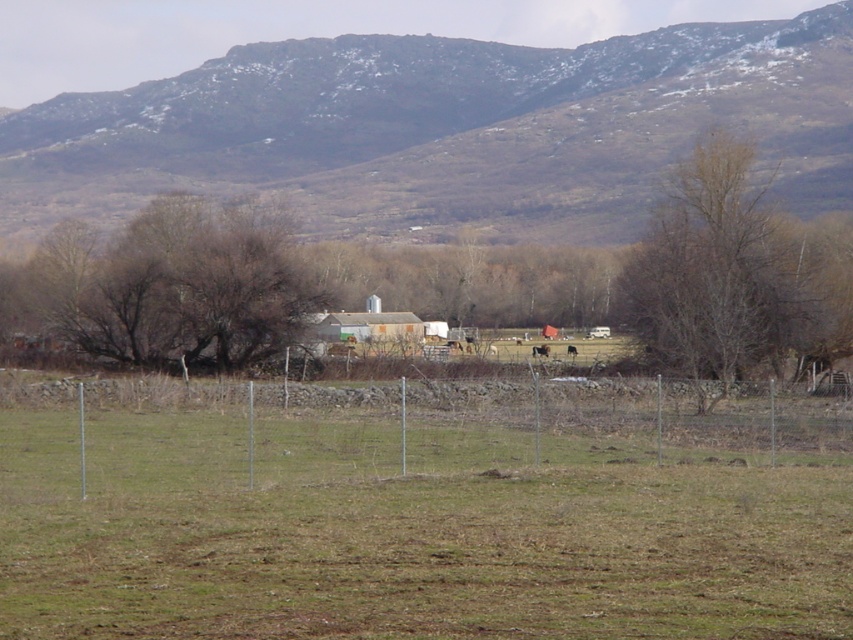
Measure the distance from brown leafless tree at center to bare wood tree at right.

A distance of 20.73 feet exists between brown leafless tree at center and bare wood tree at right.

Is point (659, 360) positioned after point (730, 358)?

Yes, point (659, 360) is farther from viewer.

Who is more distant from viewer, (517, 285) or (711, 154)?

The point (517, 285) is behind.

You are a GUI agent. You are given a task and a screenshot of the screen. Output one action in this format:
    pyautogui.click(x=<x>, y=<y>)
    Task: Click on the brown leafless tree at center
    
    Given the screenshot: What is the action you would take?
    pyautogui.click(x=460, y=282)

Can you confirm if brown leafless tree at center is positioned above brown fuzzy horse at center?

Yes, brown leafless tree at center is above brown fuzzy horse at center.

Who is positioned more to the right, brown leafless tree at center or brown fuzzy horse at center?

brown fuzzy horse at center is more to the right.

Is point (244, 348) positioned in front of point (537, 349)?

No, (244, 348) is behind (537, 349).

At what (x,y) coordinates should I click in order to perform the action: click on brown leafless tree at center. Please return your answer as a coordinate pair (x, y). Looking at the image, I should click on (460, 282).

You are a GUI agent. You are given a task and a screenshot of the screen. Output one action in this format:
    pyautogui.click(x=<x>, y=<y>)
    Task: Click on the brown leafless tree at center
    
    Given the screenshot: What is the action you would take?
    pyautogui.click(x=460, y=282)

The image size is (853, 640). What do you see at coordinates (460, 282) in the screenshot?
I see `brown leafless tree at center` at bounding box center [460, 282].

At what (x,y) coordinates should I click in order to perform the action: click on brown leafless tree at center. Please return your answer as a coordinate pair (x, y). Looking at the image, I should click on (460, 282).